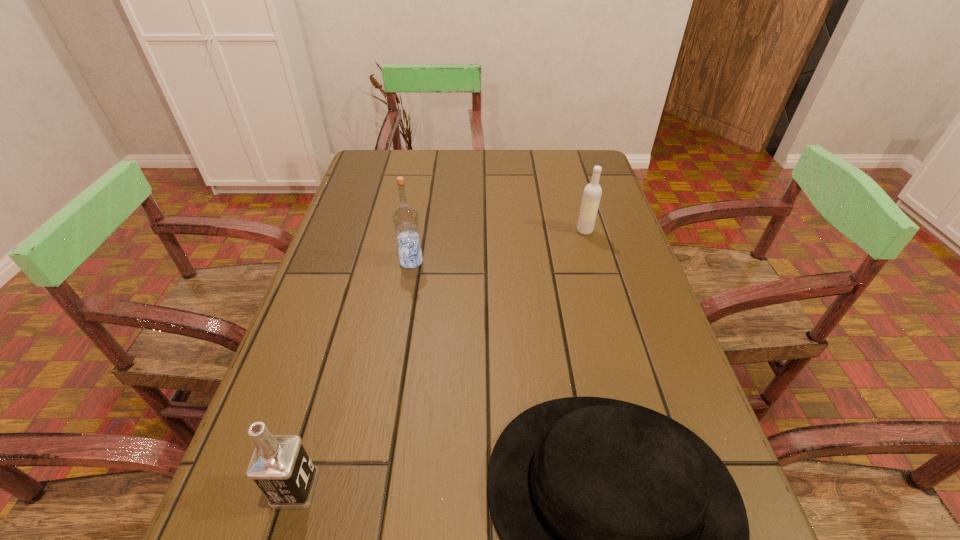
Where is `the closest vodka to the nearest vodka`? the closest vodka to the nearest vodka is located at coordinates (405, 217).

The height and width of the screenshot is (540, 960). In order to click on vodka that stands as the second closest to the leftmost object in this screenshot , I will do `click(592, 193)`.